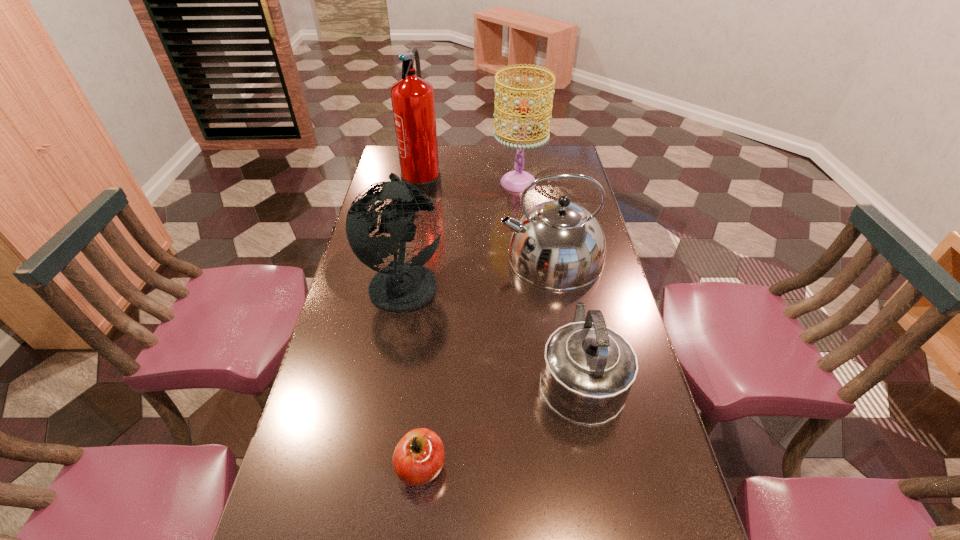
Where is `vacant area in the image that satisfies the following two spatial constraints: 1. on the front-facing side of the globe; 2. with the spout at the front of the second nearest object`? vacant area in the image that satisfies the following two spatial constraints: 1. on the front-facing side of the globe; 2. with the spout at the front of the second nearest object is located at coordinates (388, 374).

Identify the location of vacant area in the image that satisfies the following two spatial constraints: 1. with the spout at the front of the second nearest object; 2. on the front-facing side of the globe. (563, 281).

This screenshot has width=960, height=540. Find the location of `free space in the image that satisfies the following two spatial constraints: 1. from the spout of the farther kettle; 2. with the spout at the front of the fifth tallest object`. free space in the image that satisfies the following two spatial constraints: 1. from the spout of the farther kettle; 2. with the spout at the front of the fifth tallest object is located at coordinates coord(571,374).